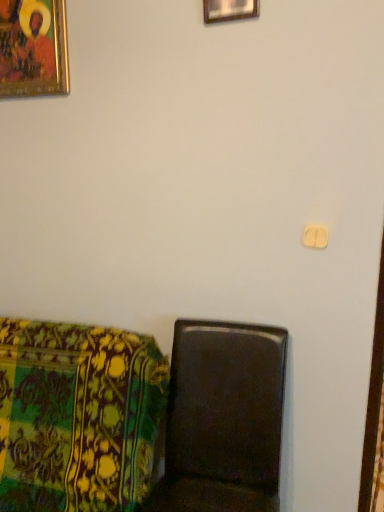
What are the coordinates of `gold-framed painting at upper left, which appears as the first picture frame when viewed from the left` in the screenshot? It's located at (33, 48).

The width and height of the screenshot is (384, 512). What do you see at coordinates (223, 419) in the screenshot?
I see `matte brown chair at lower left, marked as the first furniture in a right-to-left arrangement` at bounding box center [223, 419].

The width and height of the screenshot is (384, 512). I want to click on floral fabric cushion at lower left, the second furniture from the right, so [x=77, y=416].

This screenshot has width=384, height=512. Describe the element at coordinates (77, 416) in the screenshot. I see `floral fabric cushion at lower left, which is the first furniture in left-to-right order` at that location.

You are a GUI agent. You are given a task and a screenshot of the screen. Output one action in this format:
    pyautogui.click(x=<x>, y=<y>)
    Task: Click on the white plastic light switch at upper right
    The image size is (384, 512).
    Given the screenshot: What is the action you would take?
    pyautogui.click(x=315, y=236)

From the picture: Which object is thinner, white plastic light switch at upper right or floral fabric cushion at lower left, which is the first furniture in left-to-right order?

white plastic light switch at upper right is thinner.

Where is `light switch behind the floral fabric cushion at lower left, the second furniture from the right`? This screenshot has width=384, height=512. light switch behind the floral fabric cushion at lower left, the second furniture from the right is located at coordinates (315, 236).

Considering the sizes of white plastic light switch at upper right and floral fabric cushion at lower left, which is the first furniture in left-to-right order, in the image, is white plastic light switch at upper right taller or shorter than floral fabric cushion at lower left, which is the first furniture in left-to-right order,?

Considering their sizes, white plastic light switch at upper right has less height than floral fabric cushion at lower left, which is the first furniture in left-to-right order.

Which is correct: white plastic light switch at upper right is inside floral fabric cushion at lower left, the second furniture from the right, or outside of it?

white plastic light switch at upper right is not inside floral fabric cushion at lower left, the second furniture from the right, it's outside.

Which point is more distant from viewer, (256, 8) or (53, 7)?

Positioned behind is point (53, 7).

Which object is positioned more to the right, wooden picture frame at upper center, which is the 2th picture frame in left-to-right order, or gold-framed painting at upper left, which is the second picture frame from right to left?

Positioned to the right is wooden picture frame at upper center, which is the 2th picture frame in left-to-right order.

Is wooden picture frame at upper center, the first picture frame viewed from the front, positioned beyond the bounds of gold-framed painting at upper left, the first picture frame when ordered from back to front?

Indeed, wooden picture frame at upper center, the first picture frame viewed from the front, is completely outside gold-framed painting at upper left, the first picture frame when ordered from back to front.

Based on the photo, can you tell me how much wooden picture frame at upper center, the first picture frame viewed from the right, and gold-framed painting at upper left, which is the second picture frame from right to left, differ in facing direction?

0.561 degrees separate the facing orientations of wooden picture frame at upper center, the first picture frame viewed from the right, and gold-framed painting at upper left, which is the second picture frame from right to left.

Can you confirm if matte brown chair at lower left, the second furniture when ordered from left to right, is bigger than wooden picture frame at upper center, which is the 2th picture frame in left-to-right order?

Correct, matte brown chair at lower left, the second furniture when ordered from left to right, is larger in size than wooden picture frame at upper center, which is the 2th picture frame in left-to-right order.

What's the angular difference between matte brown chair at lower left, marked as the first furniture in a right-to-left arrangement, and wooden picture frame at upper center, the 2th picture frame viewed from the back,'s facing directions?

The angle between the facing direction of matte brown chair at lower left, marked as the first furniture in a right-to-left arrangement, and the facing direction of wooden picture frame at upper center, the 2th picture frame viewed from the back, is 2.8 degrees.

There is a matte brown chair at lower left, the second furniture when ordered from left to right. Identify the location of the 2nd picture frame above it (from a real-world perspective). (229, 10).

Could you tell me if matte brown chair at lower left, the second furniture when ordered from left to right, is facing wooden picture frame at upper center, which is the 2th picture frame in left-to-right order?

No, matte brown chair at lower left, the second furniture when ordered from left to right, does not turn towards wooden picture frame at upper center, which is the 2th picture frame in left-to-right order.

Does wooden picture frame at upper center, the first picture frame viewed from the front, have a greater width compared to matte brown chair at lower left, marked as the first furniture in a right-to-left arrangement?

No, wooden picture frame at upper center, the first picture frame viewed from the front, is not wider than matte brown chair at lower left, marked as the first furniture in a right-to-left arrangement.

Is wooden picture frame at upper center, the first picture frame viewed from the right, positioned in front of matte brown chair at lower left, the second furniture when ordered from left to right?

No, wooden picture frame at upper center, the first picture frame viewed from the right, is behind matte brown chair at lower left, the second furniture when ordered from left to right.

From a real-world perspective, is wooden picture frame at upper center, the first picture frame viewed from the front, located higher than matte brown chair at lower left, the second furniture when ordered from left to right?

Yes, from a real-world perspective, wooden picture frame at upper center, the first picture frame viewed from the front, is on top of matte brown chair at lower left, the second furniture when ordered from left to right.

Can matte brown chair at lower left, marked as the first furniture in a right-to-left arrangement, be found inside wooden picture frame at upper center, the 2th picture frame viewed from the back?

No, matte brown chair at lower left, marked as the first furniture in a right-to-left arrangement, is not inside wooden picture frame at upper center, the 2th picture frame viewed from the back.

From the image's perspective, between floral fabric cushion at lower left, the second furniture from the right, and white plastic light switch at upper right, who is located below?

From the image's view, floral fabric cushion at lower left, the second furniture from the right, is below.

Is floral fabric cushion at lower left, the second furniture from the right, positioned beyond the bounds of white plastic light switch at upper right?

floral fabric cushion at lower left, the second furniture from the right, is positioned outside white plastic light switch at upper right.

Relative to white plastic light switch at upper right, is floral fabric cushion at lower left, which is the first furniture in left-to-right order, in front or behind?

floral fabric cushion at lower left, which is the first furniture in left-to-right order, is in front of white plastic light switch at upper right.

Which is closer, (136, 355) or (310, 229)?

Point (136, 355) is positioned closer to the camera compared to point (310, 229).

Is floral fabric cushion at lower left, which is the first furniture in left-to-right order, surrounded by wooden picture frame at upper center, which is the 2th picture frame in left-to-right order?

Definitely not — floral fabric cushion at lower left, which is the first furniture in left-to-right order, is not inside wooden picture frame at upper center, which is the 2th picture frame in left-to-right order.

Could you tell me if wooden picture frame at upper center, the 2th picture frame viewed from the back, is turned towards floral fabric cushion at lower left, the second furniture from the right?

No.

Measure the distance between wooden picture frame at upper center, the first picture frame viewed from the front, and floral fabric cushion at lower left, which is the first furniture in left-to-right order.

wooden picture frame at upper center, the first picture frame viewed from the front, is 1.41 meters away from floral fabric cushion at lower left, which is the first furniture in left-to-right order.

From a real-world perspective, is wooden picture frame at upper center, the 2th picture frame viewed from the back, located beneath floral fabric cushion at lower left, which is the first furniture in left-to-right order?

No, from a real-world perspective, wooden picture frame at upper center, the 2th picture frame viewed from the back, is not below floral fabric cushion at lower left, which is the first furniture in left-to-right order.

Looking at this image, considering the positions of objects gold-framed painting at upper left, which appears as the first picture frame when viewed from the left, and wooden picture frame at upper center, which is the 2th picture frame in left-to-right order, in the image provided, who is in front, gold-framed painting at upper left, which appears as the first picture frame when viewed from the left, or wooden picture frame at upper center, which is the 2th picture frame in left-to-right order,?

Positioned in front is wooden picture frame at upper center, which is the 2th picture frame in left-to-right order.

Is gold-framed painting at upper left, which appears as the first picture frame when viewed from the left, far from wooden picture frame at upper center, which is the 2th picture frame in left-to-right order?

They are positioned close to each other.

Which of these two, gold-framed painting at upper left, which is the second picture frame from right to left, or wooden picture frame at upper center, which is the 2th picture frame in left-to-right order, is thinner?

Thinner between the two is wooden picture frame at upper center, which is the 2th picture frame in left-to-right order.

Is gold-framed painting at upper left, the first picture frame when ordered from back to front, to the right of wooden picture frame at upper center, the first picture frame viewed from the right, from the viewer's perspective?

Incorrect, gold-framed painting at upper left, the first picture frame when ordered from back to front, is not on the right side of wooden picture frame at upper center, the first picture frame viewed from the right.

This screenshot has width=384, height=512. I want to click on light switch that appears above the floral fabric cushion at lower left, which is the first furniture in left-to-right order (from a real-world perspective), so click(315, 236).

At what (x,y) coordinates should I click in order to perform the action: click on picture frame lying on the right of gold-framed painting at upper left, which appears as the first picture frame when viewed from the left. Please return your answer as a coordinate pair (x, y). The image size is (384, 512). Looking at the image, I should click on (229, 10).

Considering their positions, is wooden picture frame at upper center, the 2th picture frame viewed from the back, positioned closer to matte brown chair at lower left, the second furniture when ordered from left to right, than floral fabric cushion at lower left, which is the first furniture in left-to-right order?

floral fabric cushion at lower left, which is the first furniture in left-to-right order, is closer to matte brown chair at lower left, the second furniture when ordered from left to right.

Looking at this image, estimate the real-world distances between objects in this image. Which object is further from wooden picture frame at upper center, the first picture frame viewed from the front, white plastic light switch at upper right or gold-framed painting at upper left, the first picture frame when ordered from back to front?

Based on the image, white plastic light switch at upper right appears to be further to wooden picture frame at upper center, the first picture frame viewed from the front.

Estimate the real-world distances between objects in this image. Which object is further from floral fabric cushion at lower left, which is the first furniture in left-to-right order, white plastic light switch at upper right or gold-framed painting at upper left, the second picture frame viewed from the front?

gold-framed painting at upper left, the second picture frame viewed from the front, is further to floral fabric cushion at lower left, which is the first furniture in left-to-right order.

Considering their positions, is floral fabric cushion at lower left, which is the first furniture in left-to-right order, positioned further to white plastic light switch at upper right than gold-framed painting at upper left, which is the second picture frame from right to left?

gold-framed painting at upper left, which is the second picture frame from right to left.

Based on their spatial positions, is gold-framed painting at upper left, the second picture frame viewed from the front, or wooden picture frame at upper center, the 2th picture frame viewed from the back, closer to matte brown chair at lower left, the second furniture when ordered from left to right?

gold-framed painting at upper left, the second picture frame viewed from the front, lies closer to matte brown chair at lower left, the second furniture when ordered from left to right, than the other object.

Based on their spatial positions, is matte brown chair at lower left, the second furniture when ordered from left to right, or gold-framed painting at upper left, the first picture frame when ordered from back to front, further from wooden picture frame at upper center, the 2th picture frame viewed from the back?

matte brown chair at lower left, the second furniture when ordered from left to right, is further to wooden picture frame at upper center, the 2th picture frame viewed from the back.

Which object lies nearer to the anchor point gold-framed painting at upper left, the second picture frame viewed from the front, floral fabric cushion at lower left, the second furniture from the right, or white plastic light switch at upper right?

floral fabric cushion at lower left, the second furniture from the right.

Based on their spatial positions, is gold-framed painting at upper left, the first picture frame when ordered from back to front, or floral fabric cushion at lower left, the second furniture from the right, further from matte brown chair at lower left, the second furniture when ordered from left to right?

gold-framed painting at upper left, the first picture frame when ordered from back to front, is positioned further to the anchor matte brown chair at lower left, the second furniture when ordered from left to right.

Where is `light switch between wooden picture frame at upper center, the 2th picture frame viewed from the back, and matte brown chair at lower left, marked as the first furniture in a right-to-left arrangement, vertically`? light switch between wooden picture frame at upper center, the 2th picture frame viewed from the back, and matte brown chair at lower left, marked as the first furniture in a right-to-left arrangement, vertically is located at coordinates (315, 236).

Locate an element on the screen. The height and width of the screenshot is (512, 384). light switch that lies between gold-framed painting at upper left, which is the second picture frame from right to left, and matte brown chair at lower left, marked as the first furniture in a right-to-left arrangement, from top to bottom is located at coordinates (315, 236).

This screenshot has height=512, width=384. I want to click on light switch between gold-framed painting at upper left, which is the second picture frame from right to left, and floral fabric cushion at lower left, the second furniture from the right, from top to bottom, so click(x=315, y=236).

At what (x,y) coordinates should I click in order to perform the action: click on furniture between gold-framed painting at upper left, which appears as the first picture frame when viewed from the left, and floral fabric cushion at lower left, the second furniture from the right, in the vertical direction. Please return your answer as a coordinate pair (x, y). Looking at the image, I should click on (223, 419).